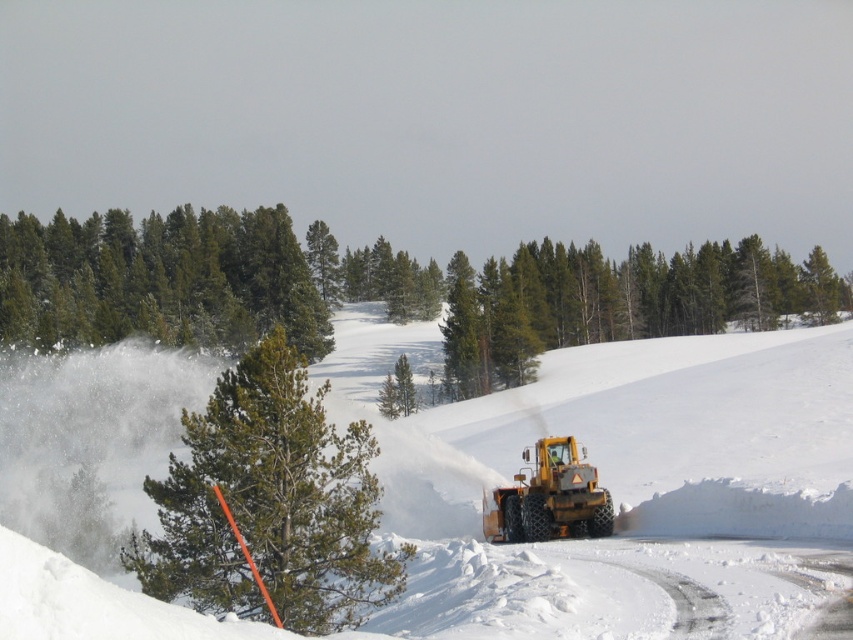
Is white fluffy snow at center above green textured pine at center?

Actually, white fluffy snow at center is below green textured pine at center.

Does point (189, 385) come closer to viewer compared to point (556, 339)?

Yes, point (189, 385) is in front of point (556, 339).

Where is `white fluffy snow at center`? The width and height of the screenshot is (853, 640). white fluffy snow at center is located at coordinates (610, 476).

In the scene shown: Who is higher up, white fluffy snow at center or green textured pine tree at center?

white fluffy snow at center is higher up.

Does white fluffy snow at center appear on the left side of green textured pine tree at center?

No, white fluffy snow at center is not to the left of green textured pine tree at center.

This screenshot has height=640, width=853. Describe the element at coordinates (610, 476) in the screenshot. I see `white fluffy snow at center` at that location.

Where is `white fluffy snow at center`? Image resolution: width=853 pixels, height=640 pixels. white fluffy snow at center is located at coordinates (610, 476).

Who is higher up, green matte trees at upper left or green textured pine at center?

green matte trees at upper left

Does green matte trees at upper left appear over green textured pine at center?

Correct, green matte trees at upper left is located above green textured pine at center.

Is point (193, 250) farther from viewer compared to point (838, 288)?

Yes, point (193, 250) is farther from viewer.

This screenshot has width=853, height=640. I want to click on green matte trees at upper left, so click(160, 280).